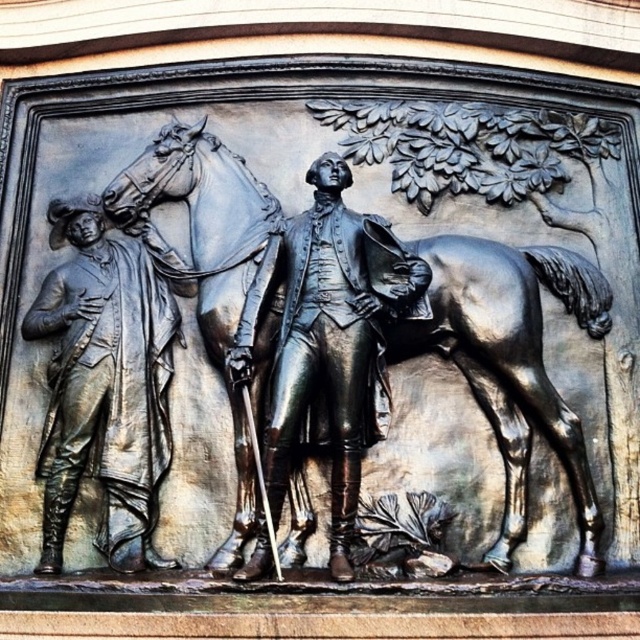
You are an art conservator examining the bronze relief sculpture. You notice two figures made of bronze. The first is the bronze figure at left, and the second is the shiny bronze statue at center. Based on their positions, which one is closer to the left edge of the sculpture?

The bronze figure at left is closer to the left edge of the sculpture because it is positioned to the left of the shiny bronze statue at center.